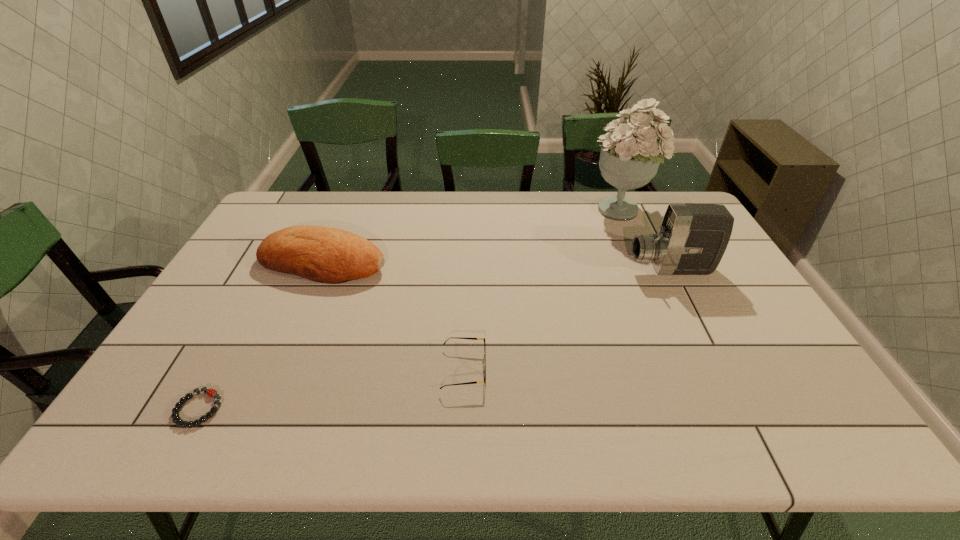
At what (x,y) coordinates should I click in order to perform the action: click on free space located at the front of the fourth shortest object, highlighting the lens. Please return your answer as a coordinate pair (x, y). This screenshot has height=540, width=960. Looking at the image, I should click on (596, 269).

Identify the location of free space located on the front of the bread. (273, 383).

You are a GUI agent. You are given a task and a screenshot of the screen. Output one action in this format:
    pyautogui.click(x=<x>, y=<y>)
    Task: Click on the vacant space located on the front-facing side of the fourth tallest object
    
    Given the screenshot: What is the action you would take?
    pyautogui.click(x=552, y=369)

At what (x,y) coordinates should I click in order to perform the action: click on blank space located 0.180m on the right of the bracelet. Please return your answer as a coordinate pair (x, y). This screenshot has height=540, width=960. Looking at the image, I should click on (301, 409).

This screenshot has width=960, height=540. I want to click on object that is at the far edge, so click(630, 156).

Locate an element on the screen. object positioned at the near edge is located at coordinates (210, 392).

Where is `bread present at the left edge`? The image size is (960, 540). bread present at the left edge is located at coordinates click(322, 254).

Identify the location of bracelet at the left edge. The width and height of the screenshot is (960, 540). (210, 392).

Identify the location of bouquet that is at the right edge. (630, 156).

This screenshot has width=960, height=540. I want to click on camcorder located at the right edge, so click(x=692, y=239).